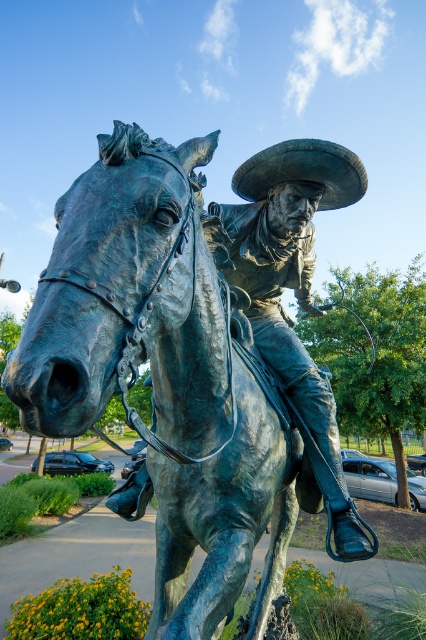
Does bronze statue at center appear on the right side of bronze textured cowboy hat at center?

Incorrect, bronze statue at center is not on the right side of bronze textured cowboy hat at center.

Can you confirm if bronze statue at center is thinner than bronze textured cowboy hat at center?

No.

The height and width of the screenshot is (640, 426). I want to click on bronze statue at center, so click(x=293, y=289).

This screenshot has height=640, width=426. In order to click on bronze statue at center in this screenshot , I will do pos(293,289).

Where is `bronze statue of horse at center`? The width and height of the screenshot is (426, 640). bronze statue of horse at center is located at coordinates (166, 376).

Which is more to the right, bronze statue of horse at center or bronze statue at center?

bronze statue at center is more to the right.

Is bronze statue of horse at center to the right of bronze statue at center from the viewer's perspective?

No, bronze statue of horse at center is not to the right of bronze statue at center.

The image size is (426, 640). Describe the element at coordinates (166, 376) in the screenshot. I see `bronze statue of horse at center` at that location.

Find the location of a particular element. bronze statue of horse at center is located at coordinates (166, 376).